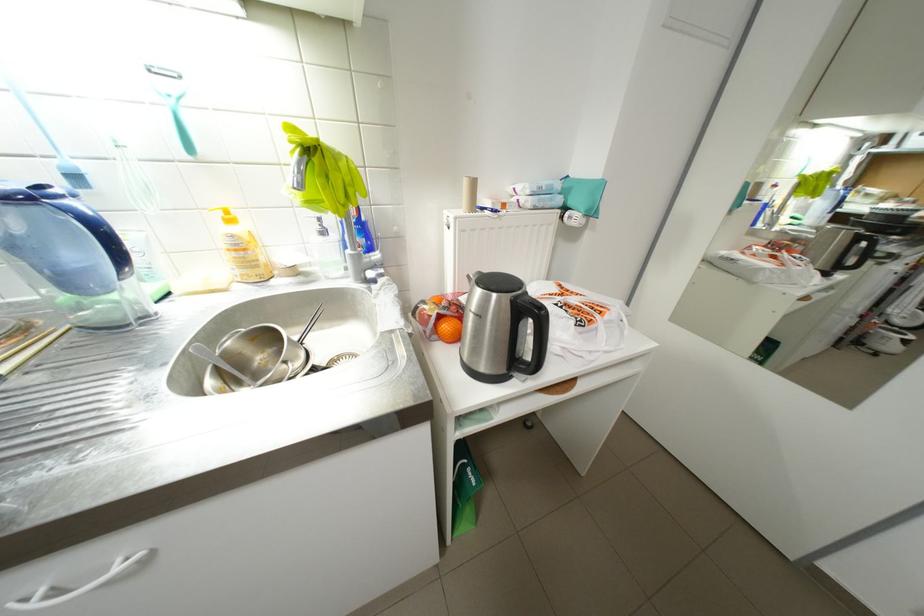
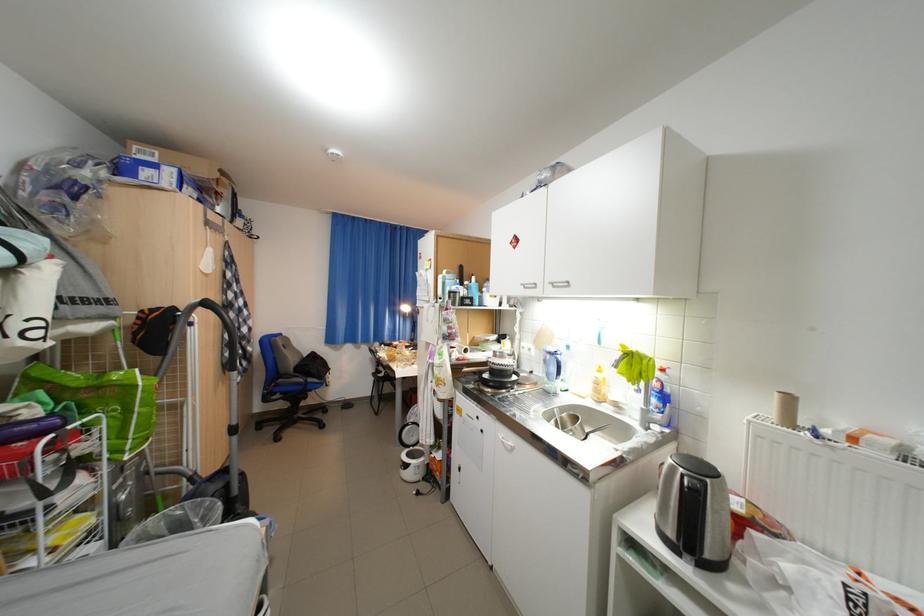
Find the pixel in the second image that matches point (79, 282) in the first image.

(560, 376)